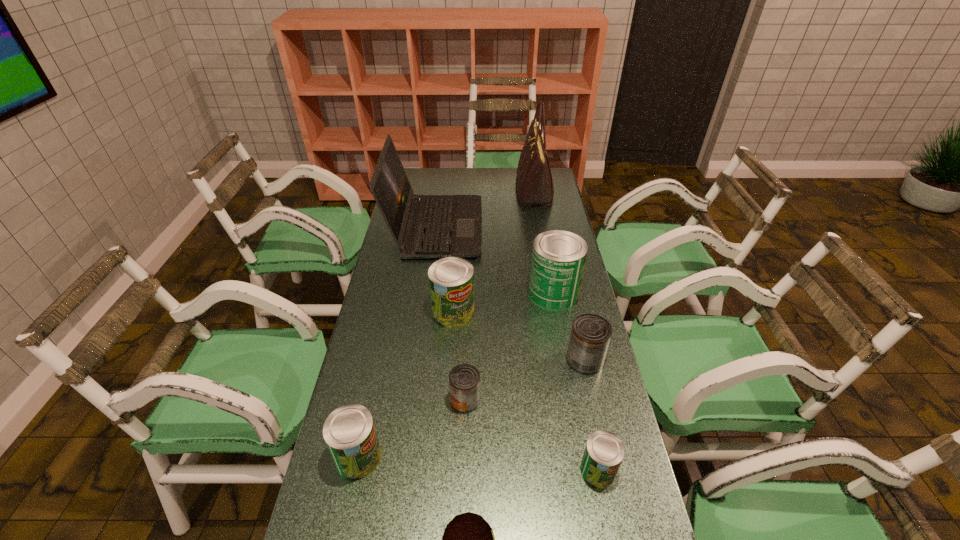
Where is `the right red can`? This screenshot has width=960, height=540. the right red can is located at coordinates (590, 336).

At what (x,y) coordinates should I click in order to perform the action: click on the smallest green can. Please return your answer as a coordinate pair (x, y). The height and width of the screenshot is (540, 960). Looking at the image, I should click on (604, 451).

Identify the location of the sixth farthest object. (464, 379).

The image size is (960, 540). In order to click on the left red can in this screenshot , I will do `click(464, 379)`.

Where is `vacant space located on the front-facing side of the tallest object`? vacant space located on the front-facing side of the tallest object is located at coordinates (440, 191).

What are the coordinates of `free region located on the front-facing side of the tallest object` in the screenshot? It's located at pos(459,191).

This screenshot has width=960, height=540. I want to click on free point located 0.360m on the front-facing side of the tallest object, so coord(440,191).

This screenshot has height=540, width=960. I want to click on free space located on the screen of the gray laptop_computer, so click(x=553, y=228).

Where is `free space located on the front of the tallest can`? The image size is (960, 540). free space located on the front of the tallest can is located at coordinates (563, 343).

You are a GUI agent. You are given a task and a screenshot of the screen. Output one action in this format:
    pyautogui.click(x=<x>, y=<y>)
    Task: Click on the vacant area located on the front of the fourth tallest object
    Image resolution: width=960 pixels, height=540 pixels.
    Given the screenshot: What is the action you would take?
    pyautogui.click(x=444, y=444)